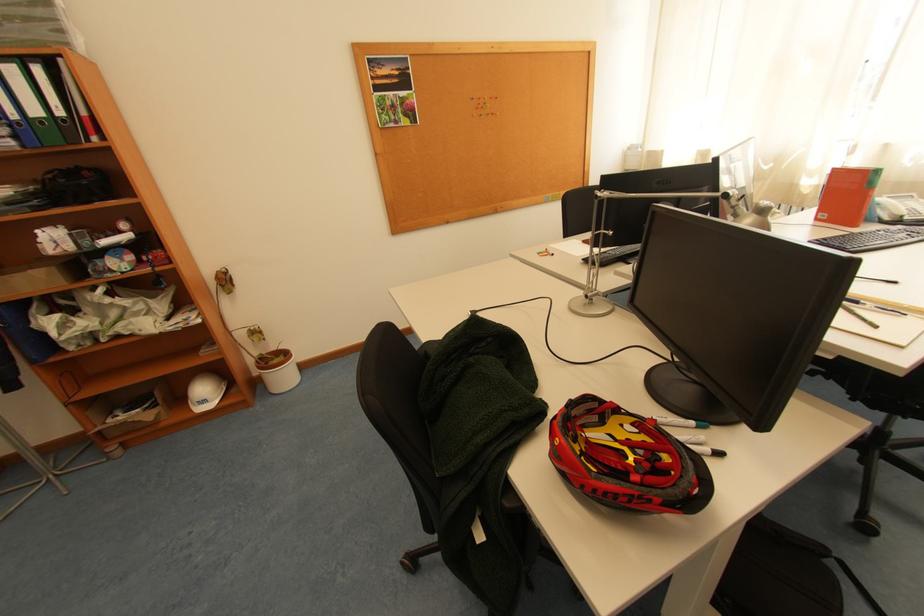
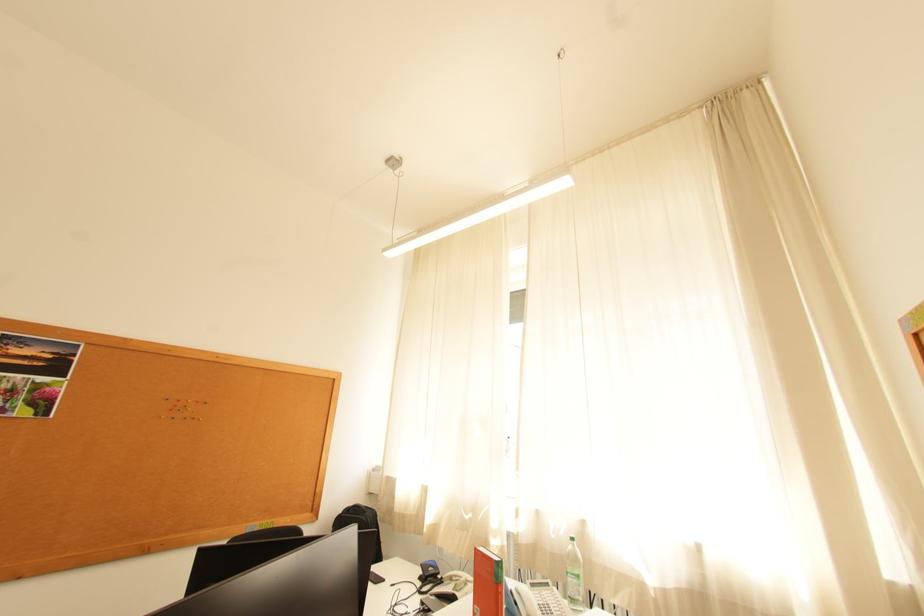
Based on the continuous images, in which direction is the camera rotating?

The camera's rotation is toward right-up.